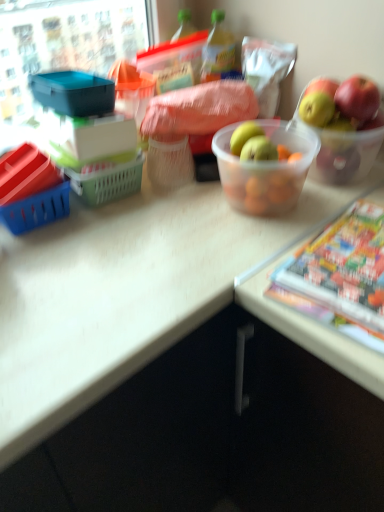
Question: Is green plastic bottle at center smaller than multicolored glossy comic book at lower right?

Choices:
 (A) yes
 (B) no

Answer: (A)

Question: Is green plastic bottle at center further to the viewer compared to multicolored glossy comic book at lower right?

Choices:
 (A) no
 (B) yes

Answer: (B)

Question: From a real-world perspective, is green plastic bottle at center positioned under multicolored glossy comic book at lower right based on gravity?

Choices:
 (A) no
 (B) yes

Answer: (A)

Question: Is green plastic bottle at center not close to multicolored glossy comic book at lower right?

Choices:
 (A) yes
 (B) no

Answer: (B)

Question: Could you tell me if green plastic bottle at center is turned towards multicolored glossy comic book at lower right?

Choices:
 (A) yes
 (B) no

Answer: (B)

Question: From a real-world perspective, is multicolored glossy comic book at lower right physically located above or below translucent plastic bowl at center?

Choices:
 (A) above
 (B) below

Answer: (B)

Question: From their relative heights in the image, would you say multicolored glossy comic book at lower right is taller or shorter than translucent plastic bowl at center?

Choices:
 (A) short
 (B) tall

Answer: (A)

Question: Is multicolored glossy comic book at lower right bigger or smaller than translucent plastic bowl at center?

Choices:
 (A) big
 (B) small

Answer: (B)

Question: From the image's perspective, is multicolored glossy comic book at lower right located above or below translucent plastic bowl at center?

Choices:
 (A) above
 (B) below

Answer: (B)

Question: Is translucent plastic bowl at center taller or shorter than green plastic bottle at center?

Choices:
 (A) short
 (B) tall

Answer: (B)

Question: Is translucent plastic bowl at center spatially inside green plastic bottle at center, or outside of it?

Choices:
 (A) outside
 (B) inside

Answer: (A)

Question: In terms of width, does translucent plastic bowl at center look wider or thinner when compared to green plastic bottle at center?

Choices:
 (A) thin
 (B) wide

Answer: (B)

Question: Visually, is translucent plastic bowl at center positioned to the left or to the right of green plastic bottle at center?

Choices:
 (A) right
 (B) left

Answer: (A)

Question: Is translucent plastic bowl at center inside or outside of multicolored glossy comic book at lower right?

Choices:
 (A) inside
 (B) outside

Answer: (B)

Question: Considering their positions, is translucent plastic bowl at center located in front of or behind multicolored glossy comic book at lower right?

Choices:
 (A) behind
 (B) front

Answer: (A)